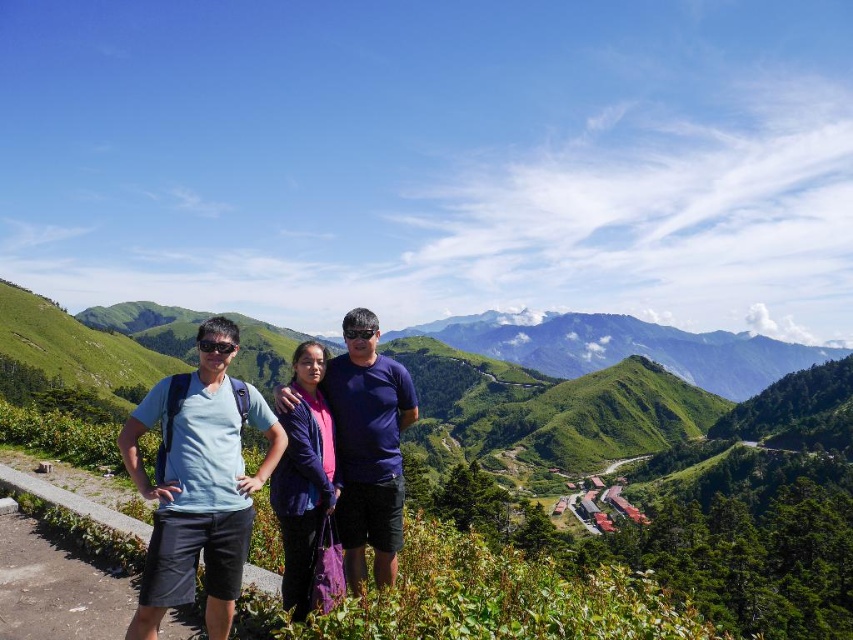
Question: Is purple matte shirt at center closer to the viewer compared to purple fabric at center?

Choices:
 (A) yes
 (B) no

Answer: (B)

Question: Does matte blue shirt at center appear under purple matte shirt at center?

Choices:
 (A) yes
 (B) no

Answer: (A)

Question: Among these points, which one is nearest to the camera?

Choices:
 (A) (189, 381)
 (B) (311, 451)
 (C) (412, 392)

Answer: (A)

Question: Observing the image, what is the correct spatial positioning of matte blue shirt at center in reference to purple fabric at center?

Choices:
 (A) right
 (B) left

Answer: (B)

Question: Considering the real-world distances, which object is farthest from the purple matte shirt at center?

Choices:
 (A) matte blue shirt at center
 (B) purple fabric at center

Answer: (A)

Question: Which object appears farthest from the camera in this image?

Choices:
 (A) purple matte shirt at center
 (B) purple fabric at center
 (C) matte blue shirt at center

Answer: (A)